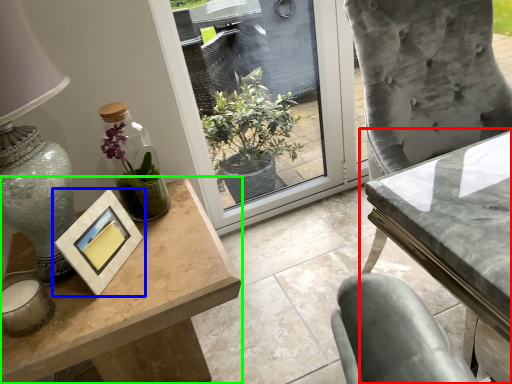
Question: Which is nearer to the table (highlighted by a red box)? picture frame (highlighted by a blue box) or table (highlighted by a green box).

Choices:
 (A) picture frame
 (B) table

Answer: (B)